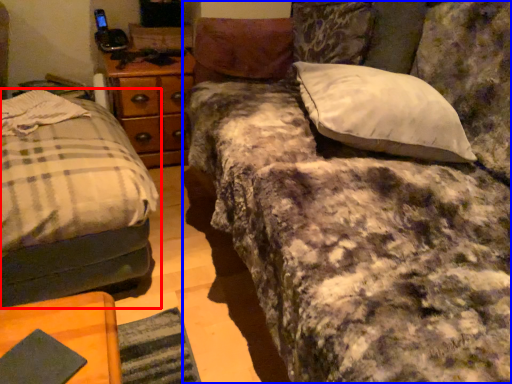
Question: Among these objects, which one is nearest to the camera, bed (highlighted by a red box) or studio couch (highlighted by a blue box)?

Choices:
 (A) bed
 (B) studio couch

Answer: (B)